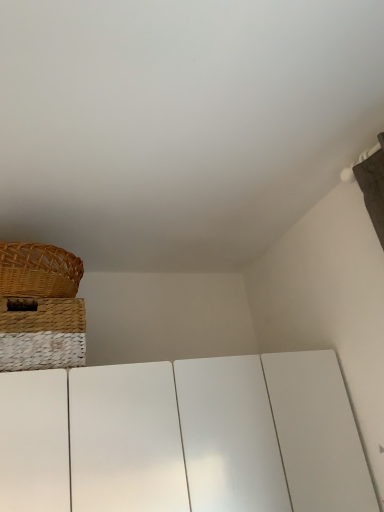
Question: Is point (34, 287) positioned closer to the camera than point (26, 339)?

Choices:
 (A) closer
 (B) farther

Answer: (B)

Question: Is woven brown picnic basket at upper left taller or shorter than woven straw basket at upper left?

Choices:
 (A) tall
 (B) short

Answer: (B)

Question: Based on their sizes in the image, would you say woven brown picnic basket at upper left is bigger or smaller than woven straw basket at upper left?

Choices:
 (A) big
 (B) small

Answer: (B)

Question: Considering the positions of woven straw basket at upper left and woven brown picnic basket at upper left in the image, is woven straw basket at upper left taller or shorter than woven brown picnic basket at upper left?

Choices:
 (A) short
 (B) tall

Answer: (B)

Question: Considering the relative positions of woven straw basket at upper left and woven brown picnic basket at upper left in the image provided, is woven straw basket at upper left to the left or to the right of woven brown picnic basket at upper left?

Choices:
 (A) right
 (B) left

Answer: (A)

Question: From a real-world perspective, relative to woven brown picnic basket at upper left, is woven straw basket at upper left vertically above or below?

Choices:
 (A) below
 (B) above

Answer: (A)

Question: Based on their sizes in the image, would you say woven straw basket at upper left is bigger or smaller than woven brown picnic basket at upper left?

Choices:
 (A) small
 (B) big

Answer: (B)